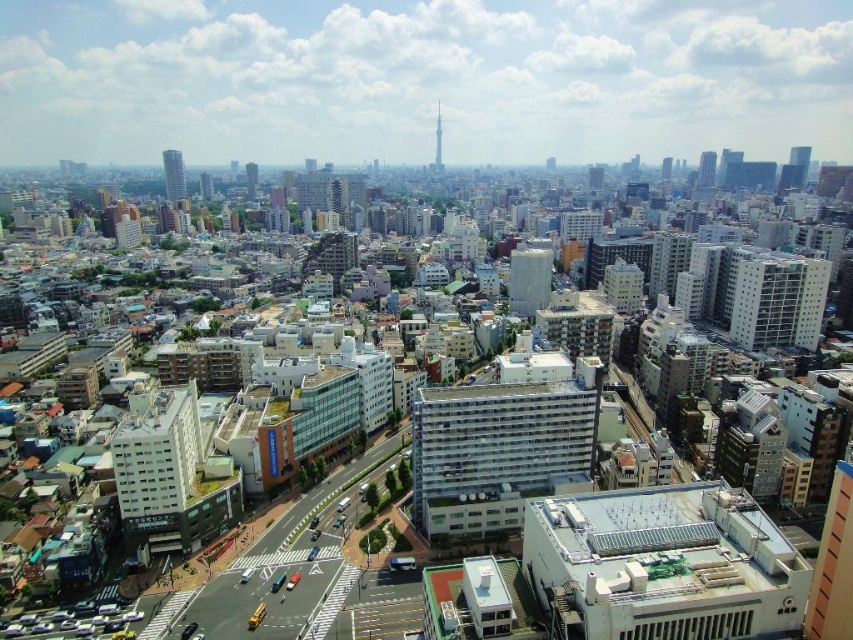
Is matte white building at center shorter than glassy steel skyscraper at upper center?

In fact, matte white building at center may be taller than glassy steel skyscraper at upper center.

From the picture: Is matte white building at center taller than glassy steel skyscraper at upper center?

Yes, matte white building at center is taller than glassy steel skyscraper at upper center.

Between point (254, 177) and point (666, 161), which one is positioned in front?

Point (254, 177)

The width and height of the screenshot is (853, 640). I want to click on matte white building at center, so click(251, 179).

Which is in front, point (508, 288) or point (180, 173)?

Point (508, 288) is in front.

From the picture: Who is higher up, white concrete building at center or matte glass skyscraper at upper left?

Positioned higher is matte glass skyscraper at upper left.

Between point (532, 301) and point (173, 179), which one is positioned behind?

The point (173, 179) is behind.

Where is `white concrete building at center`? white concrete building at center is located at coordinates (529, 280).

Is matte glass skyscraper at upper right below glassy steel skyscraper at upper center?

Indeed, matte glass skyscraper at upper right is positioned under glassy steel skyscraper at upper center.

Is matte glass skyscraper at upper right bigger than glassy steel skyscraper at upper center?

Yes.

Find the location of a particular element. This screenshot has width=853, height=640. matte glass skyscraper at upper right is located at coordinates (706, 170).